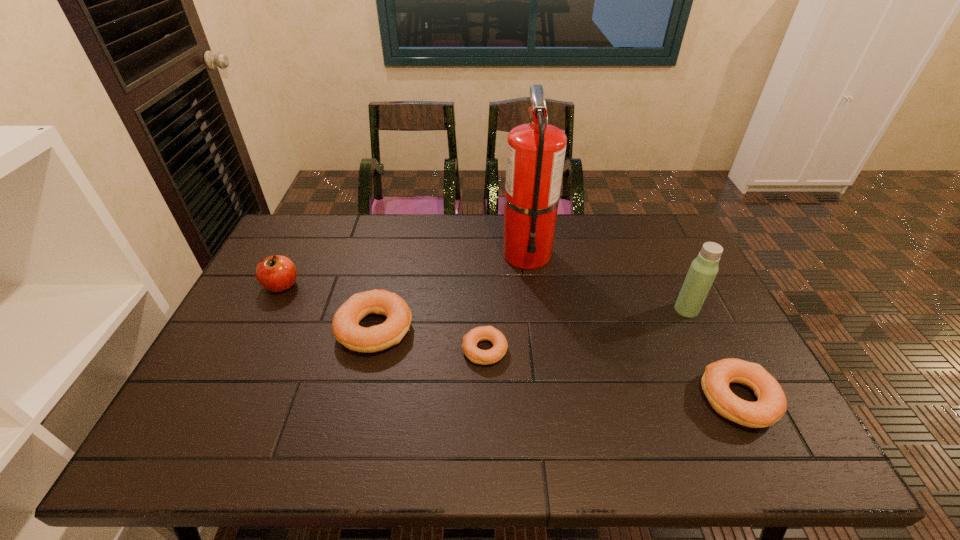
To ensure equal spacing by inserting another bagel among them, please point out a vacant spot for this new bagel. Please provide its 2D coordinates. Your answer should be formatted as a tuple, i.e. [(x, y)], where the tuple contains the x and y coordinates of a point satisfying the conditions above.

[(605, 374)]